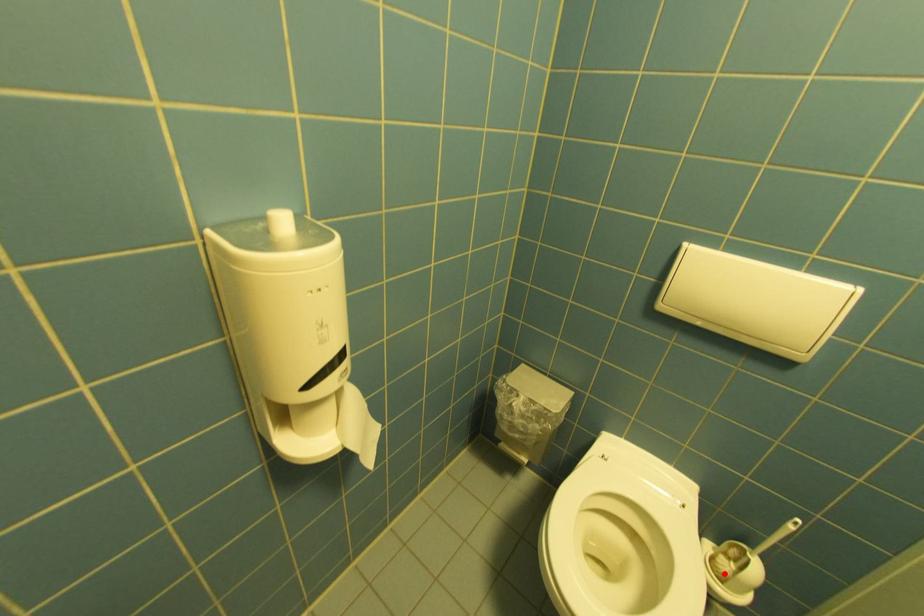
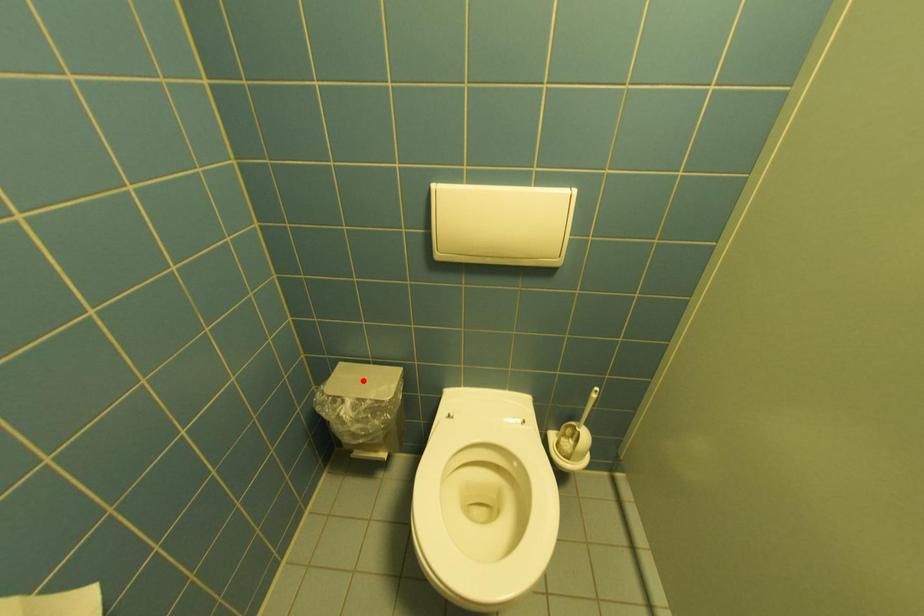
I am providing you with two images of the same scene from different viewpoints. A red point is marked on the first image and another point is marked on the second image. Is the marked point in image1 the same physical position as the marked point in image2?

No